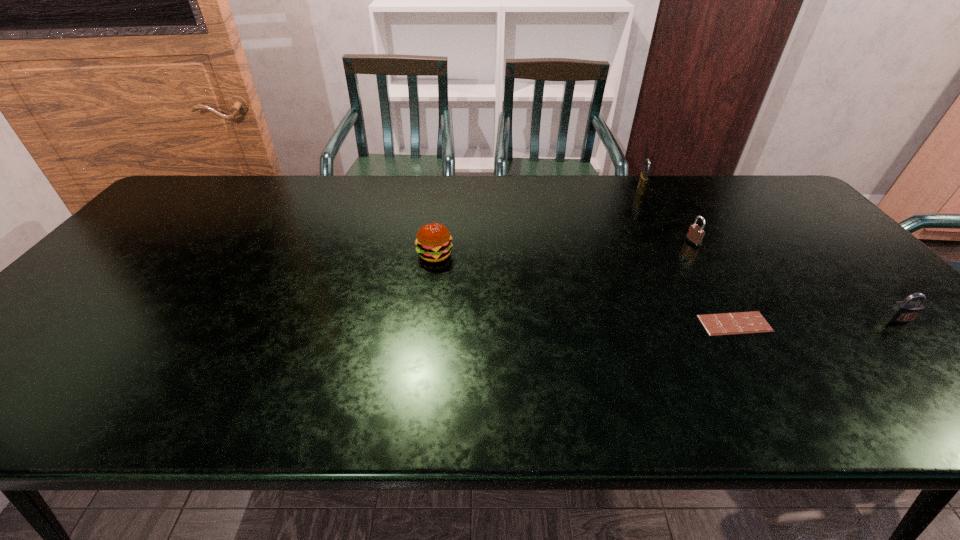
Find the location of a particular element. The image size is (960, 540). the tallest object is located at coordinates (643, 179).

I want to click on the leftmost padlock, so click(643, 179).

Locate an element on the screen. Image resolution: width=960 pixels, height=540 pixels. hamburger is located at coordinates (433, 241).

You are a GUI agent. You are given a task and a screenshot of the screen. Output one action in this format:
    pyautogui.click(x=<x>, y=<y>)
    Task: Click on the second padlock from right to left
    This screenshot has height=540, width=960.
    Given the screenshot: What is the action you would take?
    pyautogui.click(x=695, y=234)

What are the coordinates of `the nearest padlock` in the screenshot? It's located at (905, 311).

The height and width of the screenshot is (540, 960). What are the coordinates of `the rightmost padlock` in the screenshot? It's located at (905, 311).

Locate an element on the screen. The width and height of the screenshot is (960, 540). the shortest object is located at coordinates (740, 322).

The image size is (960, 540). Identify the location of blank area located 0.360m on the left of the leftmost padlock. (532, 191).

Find the location of `free space located on the left of the hamburger`. free space located on the left of the hamburger is located at coordinates (284, 254).

Locate an element on the screen. Image resolution: width=960 pixels, height=540 pixels. vacant space located 0.080m on the right of the second nearest padlock is located at coordinates (726, 242).